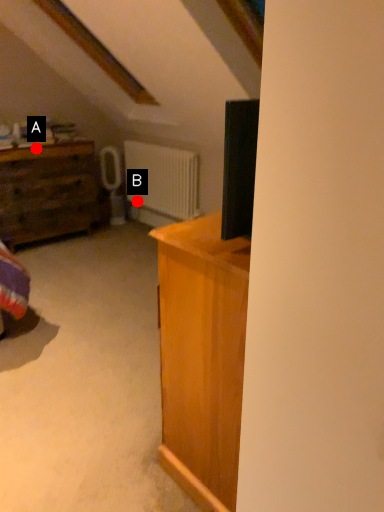
Question: Two points are circled on the image, labeled by A and B beside each circle. Which point is further to the camera?

Choices:
 (A) A is further
 (B) B is further

Answer: (B)